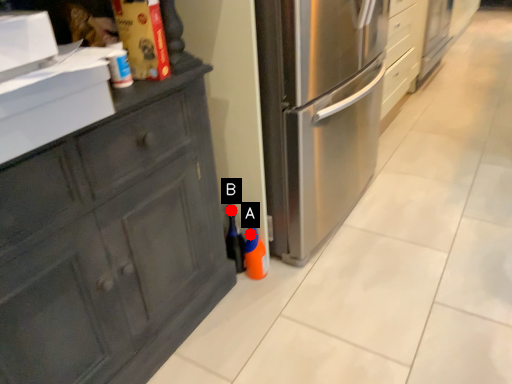
Question: Two points are circled on the image, labeled by A and B beside each circle. Which point is closer to the camera?

Choices:
 (A) A is closer
 (B) B is closer

Answer: (A)